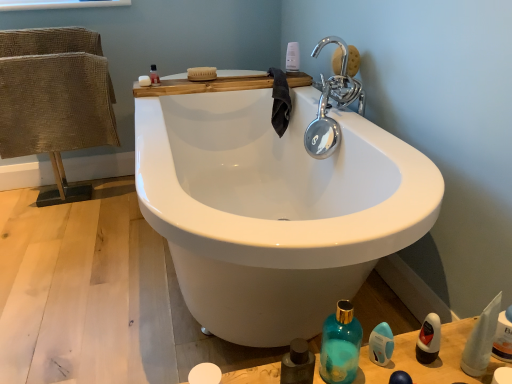
Where is `vacant space that's between black plastic bottle at lower right, which is the second mouthwash from top to bottom, and teal glass bottle at lower right`? vacant space that's between black plastic bottle at lower right, which is the second mouthwash from top to bottom, and teal glass bottle at lower right is located at coordinates (390, 357).